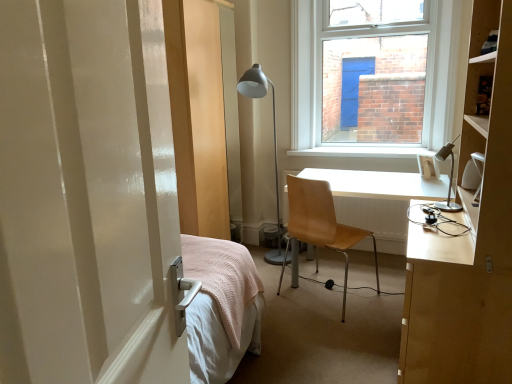
The width and height of the screenshot is (512, 384). I want to click on vacant space in light brown wood chair at center (from a real-world perspective), so click(318, 303).